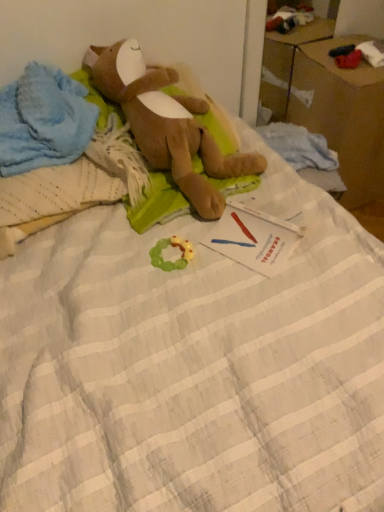
In order to click on brown cardboard box at upper right in this screenshot , I will do `click(342, 114)`.

What is the approximate width of white paper at center?

white paper at center is 21.39 centimeters in width.

Identify the location of green rubber teething ring at center, which appears as the 1th toy when viewed from the back. The image size is (384, 512). (170, 261).

Measure the distance between brown plush toy at upper left, the second toy positioned from the bottom, and camera.

They are 3.52 feet apart.

Identify the location of blue soft fabric at upper left. (43, 120).

Considering the sizes of objects brown plush toy at upper left, which is the first toy from top to bottom, and brown cardboard box at upper right in the image provided, who is wider, brown plush toy at upper left, which is the first toy from top to bottom, or brown cardboard box at upper right?

With larger width is brown cardboard box at upper right.

How much distance is there between brown plush toy at upper left, the first toy viewed from the front, and brown cardboard box at upper right?

brown plush toy at upper left, the first toy viewed from the front, is 24.13 inches away from brown cardboard box at upper right.

Considering the relative positions of brown plush toy at upper left, the first toy viewed from the front, and brown cardboard box at upper right in the image provided, is brown plush toy at upper left, the first toy viewed from the front, to the left or to the right of brown cardboard box at upper right?

Clearly, brown plush toy at upper left, the first toy viewed from the front, is on the left of brown cardboard box at upper right in the image.

Does brown plush toy at upper left, the first toy viewed from the front, contain brown cardboard box at upper right?

No, brown cardboard box at upper right is located outside of brown plush toy at upper left, the first toy viewed from the front.

From a real-world perspective, which object stands above the other?

green rubber teething ring at center, the 2th toy positioned from the front, from a real-world perspective.

How many degrees apart are the facing directions of brown cardboard box at upper right and green rubber teething ring at center, which ranks as the first toy in bottom-to-top order?

The facing directions of brown cardboard box at upper right and green rubber teething ring at center, which ranks as the first toy in bottom-to-top order, are 2.61 degrees apart.

Is the depth of brown cardboard box at upper right less than that of green rubber teething ring at center, the 2th toy when ordered from top to bottom?

No, the depth of brown cardboard box at upper right is greater than that of green rubber teething ring at center, the 2th toy when ordered from top to bottom.

Who is smaller, brown cardboard box at upper right or green rubber teething ring at center, which ranks as the first toy in bottom-to-top order?

With smaller size is green rubber teething ring at center, which ranks as the first toy in bottom-to-top order.

Considering the relative sizes of brown plush toy at upper left, the first toy viewed from the front, and white paper at center in the image provided, is brown plush toy at upper left, the first toy viewed from the front, smaller than white paper at center?

Actually, brown plush toy at upper left, the first toy viewed from the front, might be larger than white paper at center.

Looking at this image, does brown plush toy at upper left, which is the second toy from back to front, touch white paper at center?

No, brown plush toy at upper left, which is the second toy from back to front, is not with white paper at center.

How distant is brown plush toy at upper left, the first toy viewed from the front, from white paper at center?

A distance of 9.32 inches exists between brown plush toy at upper left, the first toy viewed from the front, and white paper at center.

Is brown plush toy at upper left, which is the first toy from top to bottom, closer to the viewer compared to white paper at center?

That is True.

Is white paper at center positioned with its back to blue soft fabric at upper left?

white paper at center does not have its back to blue soft fabric at upper left.

From a real-world perspective, does white paper at center stand above blue soft fabric at upper left?

No, from a real-world perspective, white paper at center is not on top of blue soft fabric at upper left.

You are a GUI agent. You are given a task and a screenshot of the screen. Output one action in this format:
    pyautogui.click(x=<x>, y=<y>)
    Task: Click on the clothing above the white paper at center (from the image's perspective)
    
    Given the screenshot: What is the action you would take?
    pyautogui.click(x=43, y=120)

Considering the sizes of objects white paper at center and blue soft fabric at upper left in the image provided, who is wider, white paper at center or blue soft fabric at upper left?

With larger width is blue soft fabric at upper left.

Is green rubber teething ring at center, which ranks as the first toy in bottom-to-top order, oriented towards blue soft fabric at upper left?

No, green rubber teething ring at center, which ranks as the first toy in bottom-to-top order, is not turned towards blue soft fabric at upper left.

From the blue soft fabric at upper left, count 1st toy to the right and point to it. Please provide its 2D coordinates.

[(170, 261)]

In the scene shown: Is green rubber teething ring at center, which appears as the 1th toy when viewed from the back, not close to blue soft fabric at upper left?

No, green rubber teething ring at center, which appears as the 1th toy when viewed from the back, is not far away from blue soft fabric at upper left.

From the image's perspective, which one is positioned lower, blue soft fabric at upper left or white paper at center?

white paper at center appears lower in the image.

Considering the relative sizes of blue soft fabric at upper left and white paper at center in the image provided, is blue soft fabric at upper left smaller than white paper at center?

Incorrect, blue soft fabric at upper left is not smaller in size than white paper at center.

Which of these two, blue soft fabric at upper left or white paper at center, is wider?

With larger width is blue soft fabric at upper left.

Which is more to the left, blue soft fabric at upper left or white paper at center?

From the viewer's perspective, blue soft fabric at upper left appears more on the left side.

Is white paper at center far from brown plush toy at upper left, which is the first toy from top to bottom?

white paper at center is near brown plush toy at upper left, which is the first toy from top to bottom, not far away.

Is brown plush toy at upper left, the second toy positioned from the bottom, inside white paper at center?

No, brown plush toy at upper left, the second toy positioned from the bottom, is not surrounded by white paper at center.

The height and width of the screenshot is (512, 384). In order to click on toy in front of the white paper at center in this screenshot , I will do `click(167, 123)`.

Find the location of a particular element. cardboard box above the brown plush toy at upper left, the first toy viewed from the front (from the image's perspective) is located at coordinates (342, 114).

Locate an element on the screen. This screenshot has height=512, width=384. cardboard box on the right of green rubber teething ring at center, which ranks as the first toy in bottom-to-top order is located at coordinates (342, 114).

When comparing their distances from green rubber teething ring at center, the 2th toy positioned from the front, does blue soft fabric at upper left or brown cardboard box at upper right seem closer?

blue soft fabric at upper left is positioned closer to the anchor green rubber teething ring at center, the 2th toy positioned from the front.

Estimate the real-world distances between objects in this image. Which object is closer to green rubber teething ring at center, which appears as the 1th toy when viewed from the back, white paper at center or blue soft fabric at upper left?

white paper at center is closer to green rubber teething ring at center, which appears as the 1th toy when viewed from the back.

When comparing their distances from blue soft fabric at upper left, does brown plush toy at upper left, which is the first toy from top to bottom, or green rubber teething ring at center, which appears as the 1th toy when viewed from the back, seem further?

The object further to blue soft fabric at upper left is green rubber teething ring at center, which appears as the 1th toy when viewed from the back.

Looking at the image, which one is located further to white paper at center, brown plush toy at upper left, the second toy positioned from the bottom, or blue soft fabric at upper left?

Among the two, blue soft fabric at upper left is located further to white paper at center.

Looking at the image, which one is located further to green rubber teething ring at center, which appears as the 1th toy when viewed from the back, blue soft fabric at upper left or white paper at center?

Based on the image, blue soft fabric at upper left appears to be further to green rubber teething ring at center, which appears as the 1th toy when viewed from the back.

Which object lies further to the anchor point brown cardboard box at upper right, white paper at center or green rubber teething ring at center, which appears as the 1th toy when viewed from the back?

green rubber teething ring at center, which appears as the 1th toy when viewed from the back, is positioned further to the anchor brown cardboard box at upper right.

Estimate the real-world distances between objects in this image. Which object is closer to brown cardboard box at upper right, green rubber teething ring at center, the 2th toy positioned from the front, or blue soft fabric at upper left?

Among the two, green rubber teething ring at center, the 2th toy positioned from the front, is located nearer to brown cardboard box at upper right.

Estimate the real-world distances between objects in this image. Which object is closer to brown cardboard box at upper right, brown plush toy at upper left, which is the first toy from top to bottom, or blue soft fabric at upper left?

brown plush toy at upper left, which is the first toy from top to bottom, is closer to brown cardboard box at upper right.

The width and height of the screenshot is (384, 512). I want to click on toy between green rubber teething ring at center, which ranks as the first toy in bottom-to-top order, and brown cardboard box at upper right, in the horizontal direction, so click(167, 123).

The height and width of the screenshot is (512, 384). In order to click on postcard between brown plush toy at upper left, which is the second toy from back to front, and green rubber teething ring at center, the 2th toy when ordered from top to bottom, in the up-down direction in this screenshot , I will do `click(254, 238)`.

Identify the location of clothing between brown plush toy at upper left, which is the first toy from top to bottom, and green rubber teething ring at center, the 2th toy when ordered from top to bottom, in the up-down direction. (43, 120).

This screenshot has width=384, height=512. I want to click on postcard between green rubber teething ring at center, which ranks as the first toy in bottom-to-top order, and brown cardboard box at upper right, so click(254, 238).